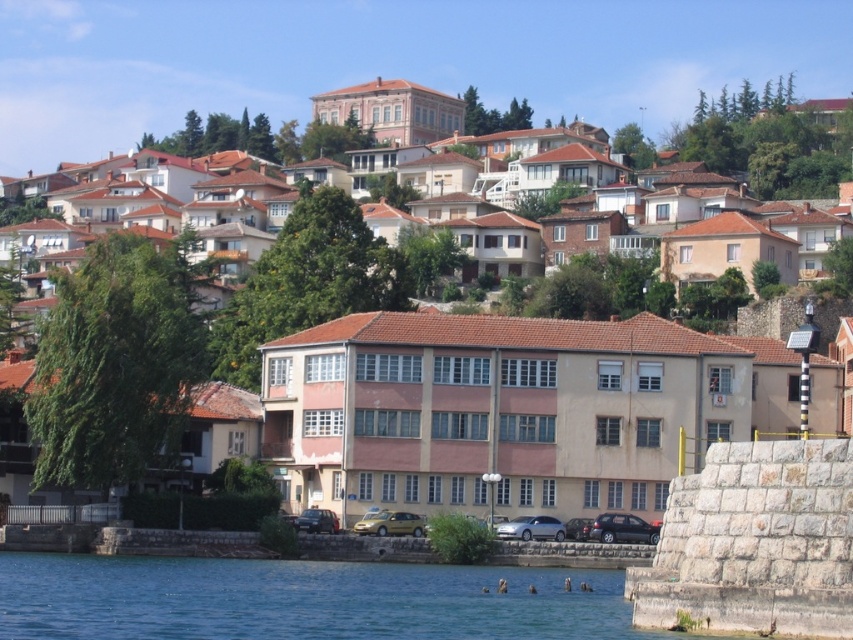
Question: Among these objects, which one is farthest from the camera?

Choices:
 (A) pink matte building at center
 (B) metallic silver car at center
 (C) satin silver car at lower center
 (D) satin black car at lower right

Answer: (B)

Question: Among these points, which one is farthest from the camera?

Choices:
 (A) (531, 532)
 (B) (323, 528)

Answer: (A)

Question: Which point is farther to the camera?

Choices:
 (A) (300, 492)
 (B) (322, 516)
 (C) (572, 518)
 (D) (358, 532)

Answer: (A)

Question: Does blue water at lower left have a lesser width compared to satin silver car at lower center?

Choices:
 (A) yes
 (B) no

Answer: (B)

Question: Is gold metallic car at center thinner than metallic silver car at lower center?

Choices:
 (A) no
 (B) yes

Answer: (A)

Question: Is satin black car at lower right further to the viewer compared to metallic silver car at center?

Choices:
 (A) no
 (B) yes

Answer: (A)